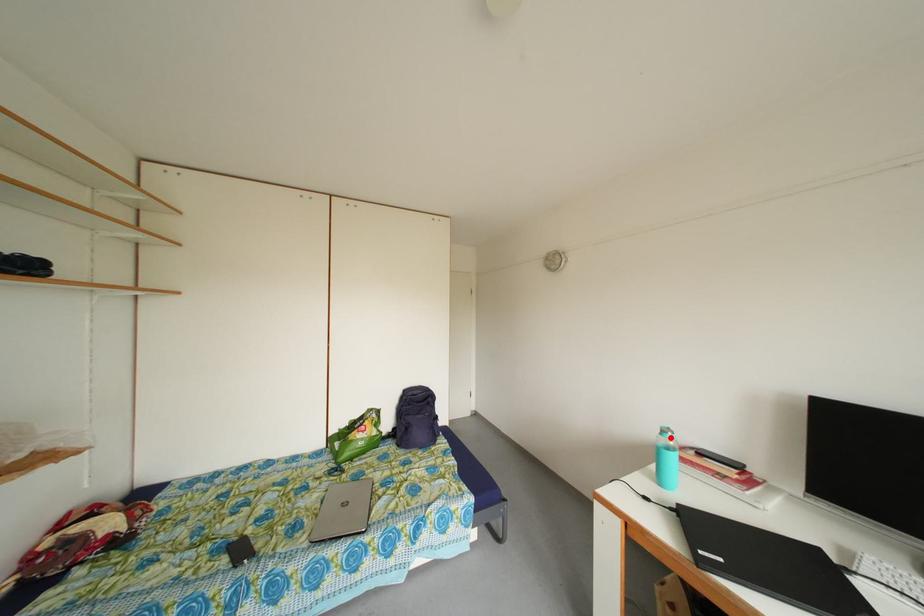
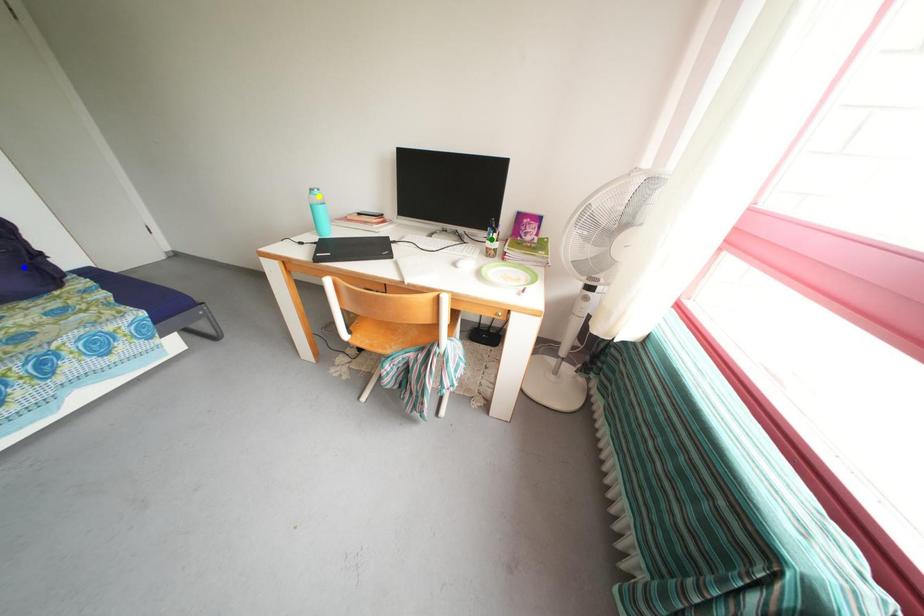
Question: I am providing you with two images of the same scene from different viewpoints. A red point is marked on the first image. You are given multiple points on the second image. Which point in image 2 is actually the same real-world point as the red point in image 1?

Choices:
 (A) yellow point
 (B) blue point
 (C) green point

Answer: (A)